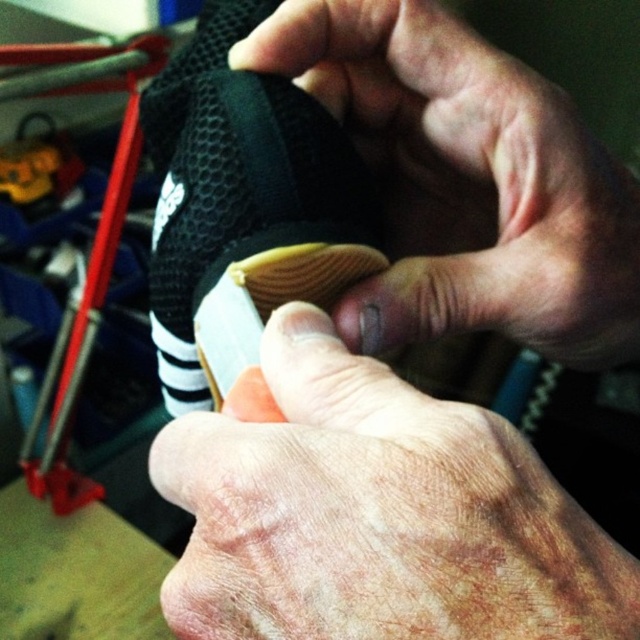
Question: Can you confirm if dry skin at center is smaller than black matte shoe at center?

Choices:
 (A) yes
 (B) no

Answer: (B)

Question: Does dry skin at center have a greater width compared to black matte shoe at center?

Choices:
 (A) no
 (B) yes

Answer: (B)

Question: Is dry skin at center to the right of black matte shoe at center from the viewer's perspective?

Choices:
 (A) yes
 (B) no

Answer: (A)

Question: Which of the following is the farthest from the observer?

Choices:
 (A) black matte shoe at center
 (B) dry skin at center

Answer: (A)